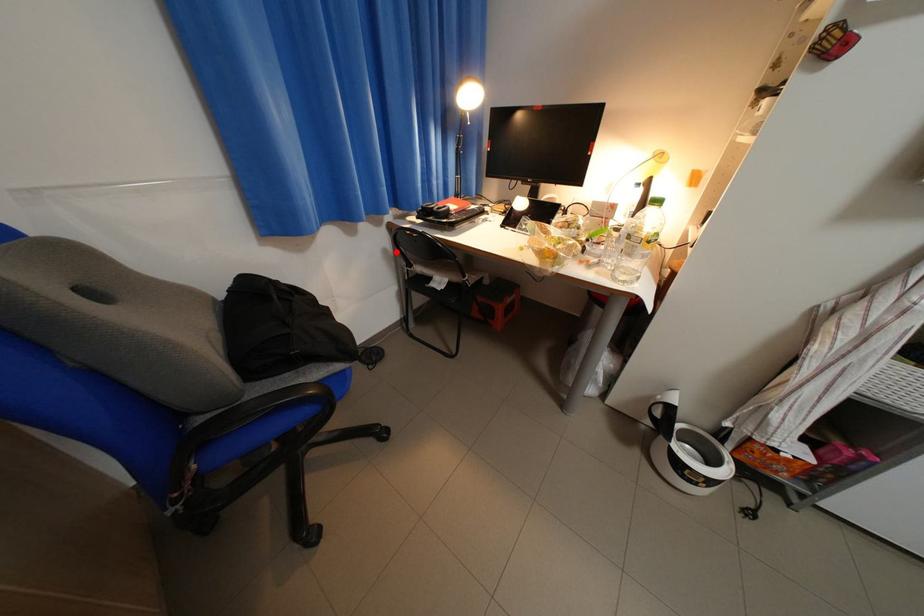
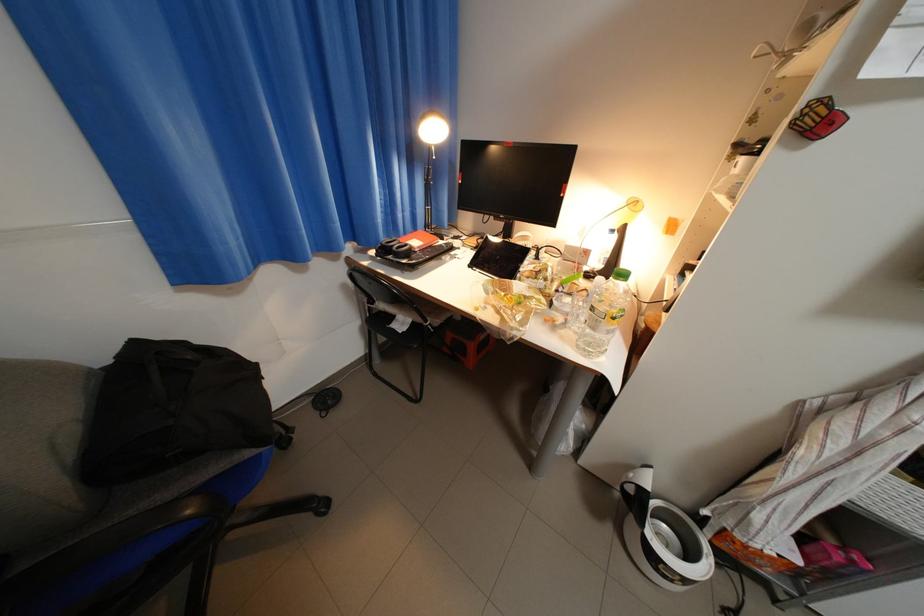
Question: I am providing you with two images of the same scene from different viewpoints. Image1 has a red point marked. In image2, the corresponding 3D location appears at what relative position? Reply with the corresponding letter.

Choices:
 (A) Closer
 (B) Farther

Answer: (B)